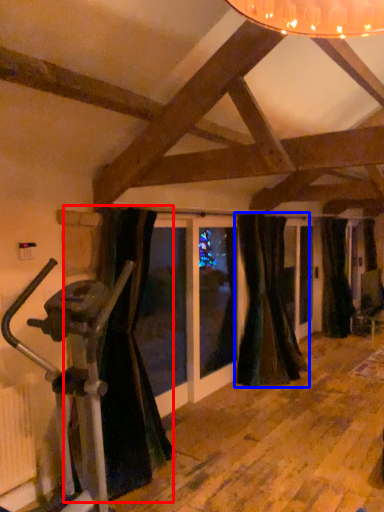
Question: Which object appears farthest to the camera in this image, curtain (highlighted by a red box) or curtain (highlighted by a blue box)?

Choices:
 (A) curtain
 (B) curtain

Answer: (B)